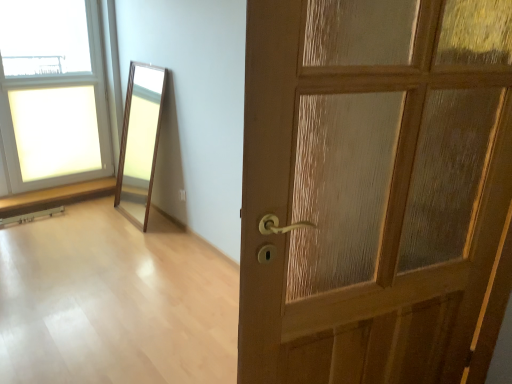
Question: Does clear glass window at upper left appear on the left side of wooden floor at center?

Choices:
 (A) yes
 (B) no

Answer: (A)

Question: From a real-world perspective, is clear glass window at upper left beneath wooden floor at center?

Choices:
 (A) yes
 (B) no

Answer: (B)

Question: Considering the relative sizes of clear glass window at upper left and wooden floor at center in the image provided, is clear glass window at upper left taller than wooden floor at center?

Choices:
 (A) yes
 (B) no

Answer: (A)

Question: Is clear glass window at upper left oriented towards wooden floor at center?

Choices:
 (A) no
 (B) yes

Answer: (B)

Question: Can you confirm if clear glass window at upper left is shorter than wooden floor at center?

Choices:
 (A) yes
 (B) no

Answer: (B)

Question: In terms of height, does clear glass window at upper left look taller or shorter compared to wooden floor at center?

Choices:
 (A) tall
 (B) short

Answer: (A)

Question: From a real-world perspective, relative to wooden floor at center, is clear glass window at upper left vertically above or below?

Choices:
 (A) below
 (B) above

Answer: (B)

Question: In terms of width, does clear glass window at upper left look wider or thinner when compared to wooden floor at center?

Choices:
 (A) wide
 (B) thin

Answer: (B)

Question: From the image's perspective, relative to wooden floor at center, is clear glass window at upper left above or below?

Choices:
 (A) above
 (B) below

Answer: (A)

Question: In terms of height, does wooden floor at center look taller or shorter compared to clear glass window at upper left?

Choices:
 (A) tall
 (B) short

Answer: (B)

Question: Considering their positions, is wooden floor at center located in front of or behind clear glass window at upper left?

Choices:
 (A) front
 (B) behind

Answer: (A)

Question: Based on their sizes in the image, would you say wooden floor at center is bigger or smaller than clear glass window at upper left?

Choices:
 (A) small
 (B) big

Answer: (A)

Question: In terms of width, does wooden floor at center look wider or thinner when compared to clear glass window at upper left?

Choices:
 (A) wide
 (B) thin

Answer: (A)

Question: Considering their positions, is wooden door at right located in front of or behind wooden floor at center?

Choices:
 (A) behind
 (B) front

Answer: (B)

Question: From a real-world perspective, relative to wooden floor at center, is wooden door at right vertically above or below?

Choices:
 (A) below
 (B) above

Answer: (B)